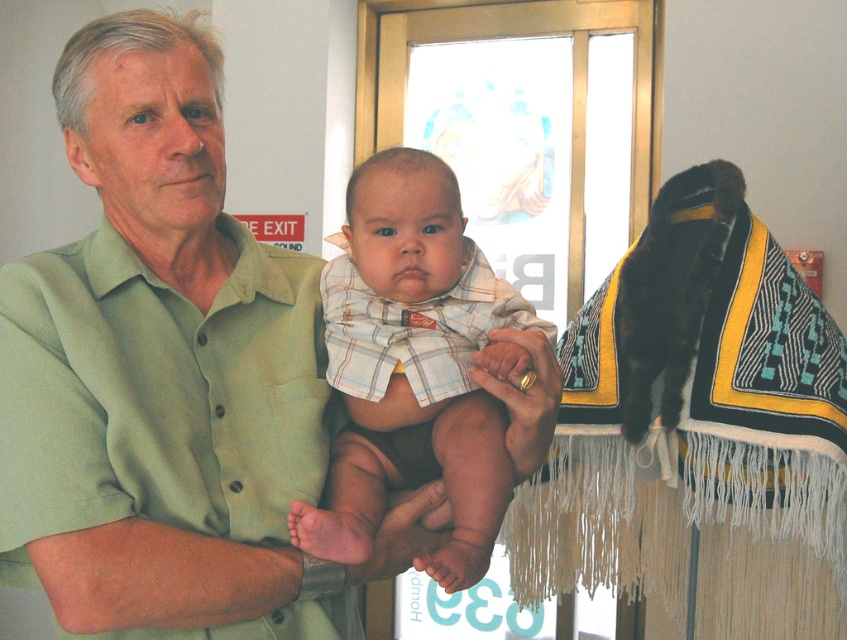
Question: Which object is the farthest from the plaid fabric baby at center?

Choices:
 (A) black woven blanket at upper right
 (B) green cotton shirt at center

Answer: (A)

Question: Among these objects, which one is nearest to the camera?

Choices:
 (A) black woven blanket at upper right
 (B) plaid fabric baby at center
 (C) green cotton shirt at center

Answer: (C)

Question: Which point is closer to the camera?

Choices:
 (A) black woven blanket at upper right
 (B) plaid fabric baby at center

Answer: (B)

Question: Observing the image, what is the correct spatial positioning of black woven blanket at upper right in reference to plaid fabric baby at center?

Choices:
 (A) left
 (B) right

Answer: (B)

Question: Does green cotton shirt at center have a smaller size compared to plaid fabric baby at center?

Choices:
 (A) yes
 (B) no

Answer: (B)

Question: Is green cotton shirt at center thinner than plaid fabric baby at center?

Choices:
 (A) yes
 (B) no

Answer: (B)